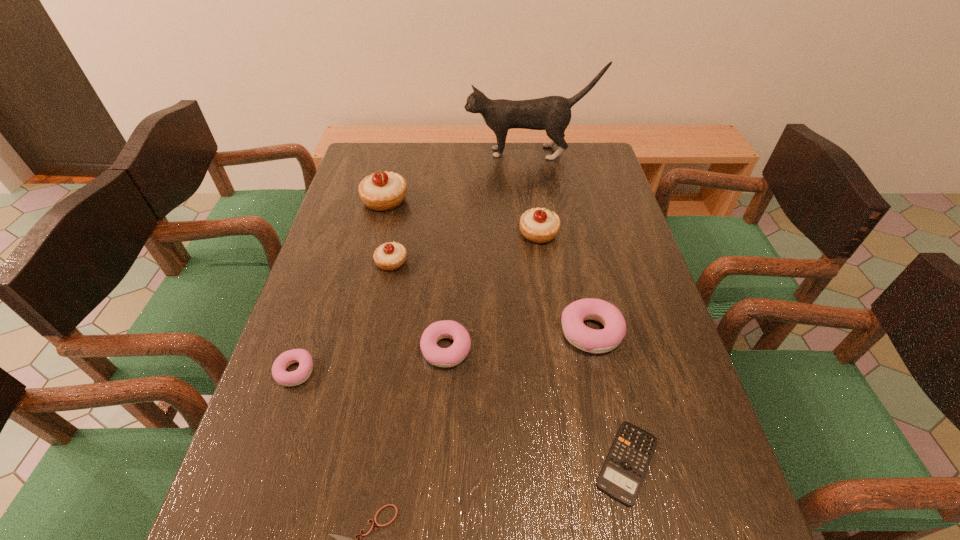
Find the location of a particular element. The image size is (960, 540). free space located on the right of the sixth shortest object is located at coordinates (444, 262).

Where is `vacant space located on the left of the third shortest pastry`? vacant space located on the left of the third shortest pastry is located at coordinates (404, 332).

Identify the location of free point located on the back of the fourth pastry from left to right. (451, 267).

In order to click on vacant area situated 0.250m on the back of the leftmost pink pastry in this screenshot , I will do `click(327, 276)`.

Find the location of a particular element. free spot located on the left of the eighth tallest object is located at coordinates (455, 462).

Where is `object that is positioned at the far edge`? object that is positioned at the far edge is located at coordinates (552, 113).

This screenshot has height=540, width=960. Find the location of `cat at the right edge`. cat at the right edge is located at coordinates (552, 113).

Locate an element on the screen. The height and width of the screenshot is (540, 960). pastry that is positioned at the right edge is located at coordinates click(576, 332).

Locate an element on the screen. This screenshot has height=540, width=960. calculator that is at the right edge is located at coordinates (623, 472).

Locate an element on the screen. object at the far right corner is located at coordinates (552, 113).